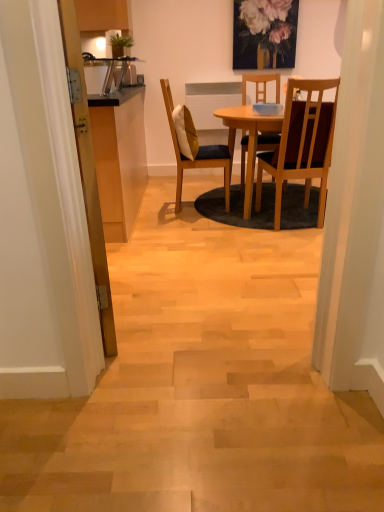
Identify the location of unoccupied space behind wooden door at left. The image size is (384, 512). (139, 267).